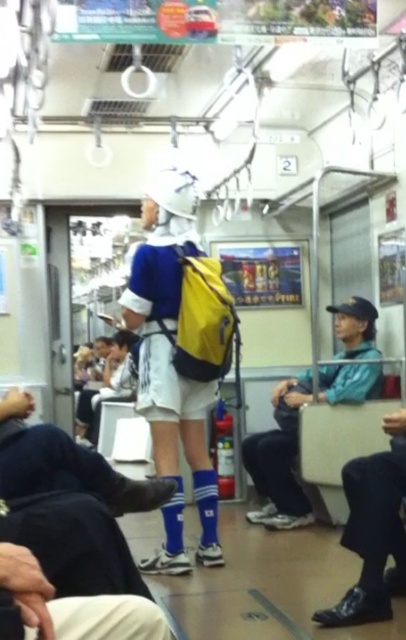
Which is more to the right, matte blue jersey at center or teal matte jacket at center?

teal matte jacket at center is more to the right.

Is matte blue jersey at center positioned at the back of teal matte jacket at center?

No, it is in front of teal matte jacket at center.

Between point (151, 278) and point (328, 388), which one is positioned behind?

Point (328, 388)

Find the location of a particular element. This screenshot has width=406, height=640. matte blue jersey at center is located at coordinates pos(170,365).